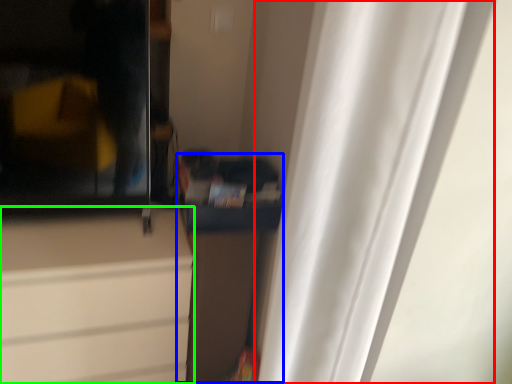
Question: Based on their relative distances, which object is farther from curtain (highlighted by a red box)? Choose from cabinetry (highlighted by a blue box) and cabinetry (highlighted by a green box).

Choices:
 (A) cabinetry
 (B) cabinetry

Answer: (B)